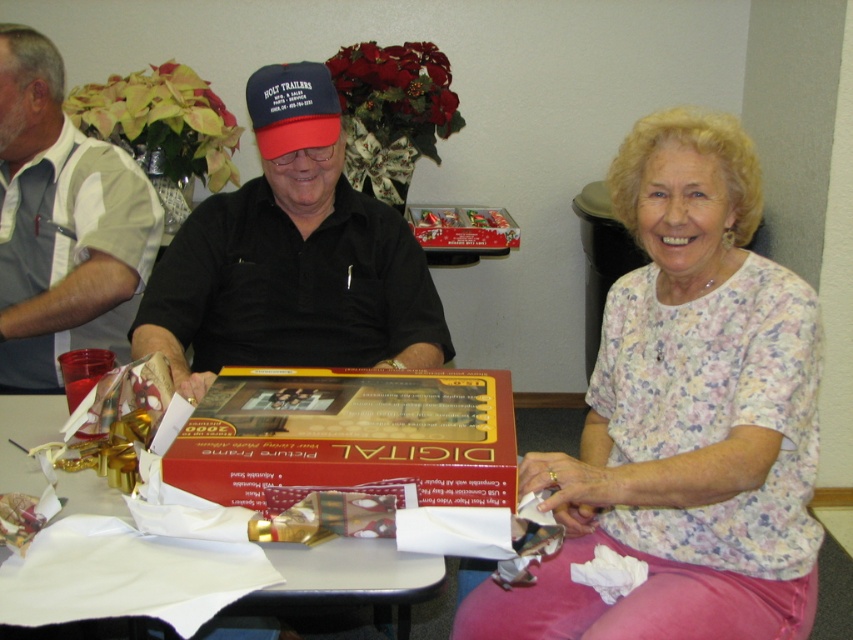
Can you confirm if matte black cap at center is positioned to the right of gray fabric shirt at left?

Yes, matte black cap at center is to the right of gray fabric shirt at left.

Is matte black cap at center taller than gray fabric shirt at left?

No, matte black cap at center is not taller than gray fabric shirt at left.

Where is `matte black cap at center`? Image resolution: width=853 pixels, height=640 pixels. matte black cap at center is located at coordinates (291, 257).

Is point (3, 262) farther from camera compared to point (410, 556)?

Yes, point (3, 262) is farther from viewer.

Can you confirm if gray fabric shirt at left is positioned to the right of white paper at center?

No, gray fabric shirt at left is not to the right of white paper at center.

At what (x,y) coordinates should I click in order to perform the action: click on gray fabric shirt at left. Please return your answer as a coordinate pair (x, y). The height and width of the screenshot is (640, 853). Looking at the image, I should click on (61, 221).

Which is in front, point (564, 582) or point (47, 179)?

Positioned in front is point (564, 582).

Between point (614, 452) and point (152, 218), which one is positioned behind?

The point (152, 218) is more distant.

Is point (590, 381) closer to viewer compared to point (83, 147)?

Yes, point (590, 381) is in front of point (83, 147).

Where is `floral fabric blouse at center`? The width and height of the screenshot is (853, 640). floral fabric blouse at center is located at coordinates (683, 417).